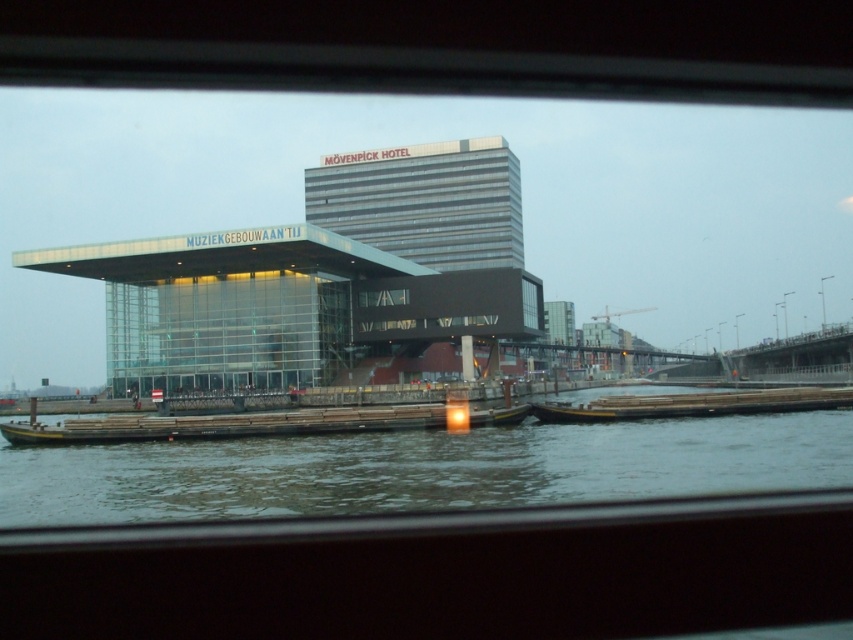
Is point (183, 515) in front of point (844, 400)?

Yes, it is.

Is greenish water at lower center to the left of wooden planks at lower center from the viewer's perspective?

Yes, greenish water at lower center is to the left of wooden planks at lower center.

Which is behind, point (502, 499) or point (737, 412)?

Point (737, 412)

Identify the location of greenish water at lower center. This screenshot has height=640, width=853. (422, 468).